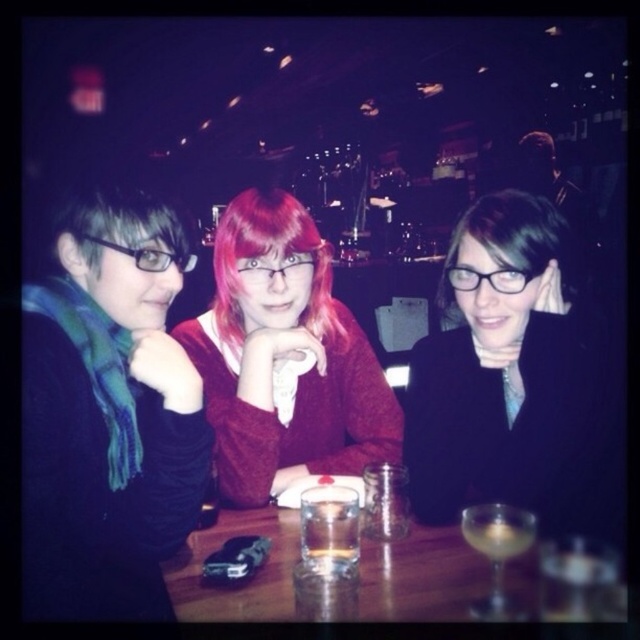
Question: Which point is farther to the camera?

Choices:
 (A) green knitted scarf at left
 (B) matte red sweater at center
 (C) pink silky hair at center

Answer: (C)

Question: Does matte red sweater at center lie in front of translucent glass at center?

Choices:
 (A) yes
 (B) no

Answer: (B)

Question: Which of the following is the closest to the observer?

Choices:
 (A) (332, 308)
 (B) (342, 561)
 (C) (467, 532)

Answer: (C)

Question: Can you confirm if green knitted scarf at left is positioned below dark brown matte hair at center?

Choices:
 (A) no
 (B) yes

Answer: (B)

Question: Which point is farther from the camera taking this photo?

Choices:
 (A) (67, 204)
 (B) (444, 273)
 (C) (275, 388)
 (D) (227, 273)

Answer: (C)

Question: Is matte red sweater at center positioned behind transparent glass table at center?

Choices:
 (A) no
 (B) yes

Answer: (B)